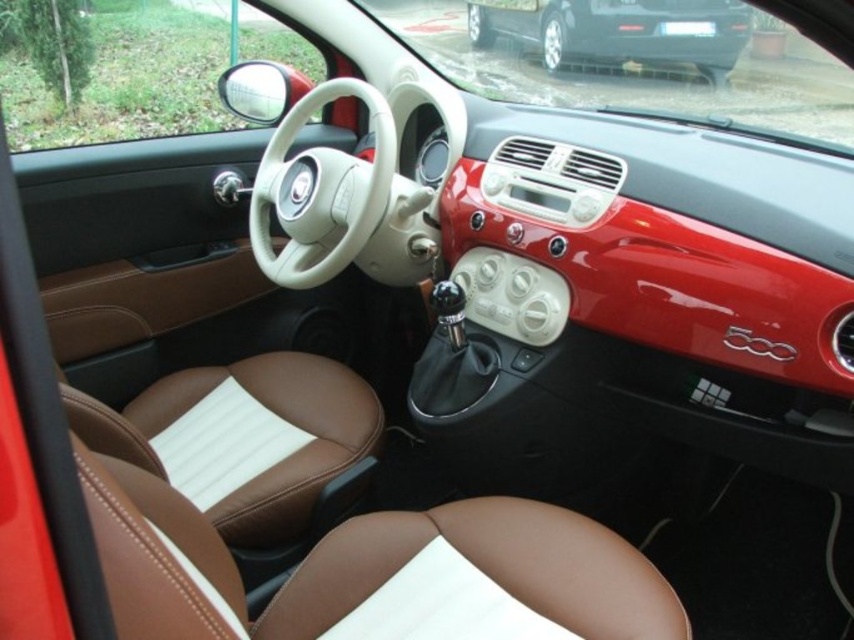
You are sitting in the driver seat of the red Fiat 500 and want to reach two points inside the car. The first point is at coordinate point (335, 172) and the second is at point (547, 22). Which point is closer to you?

Point (335, 172) is closer to the viewer than point (547, 22).